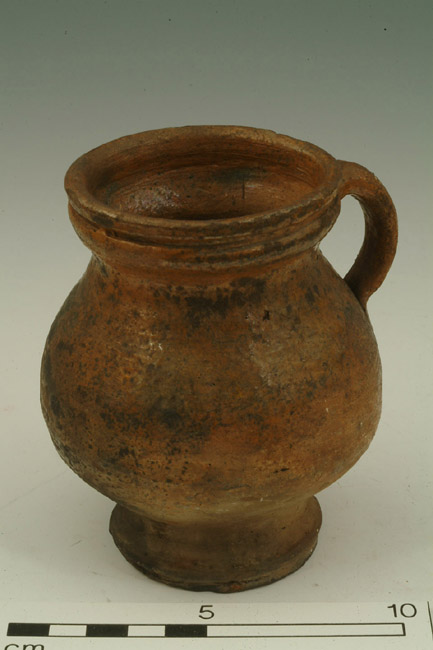
The width and height of the screenshot is (433, 650). I want to click on handle, so click(x=384, y=212).